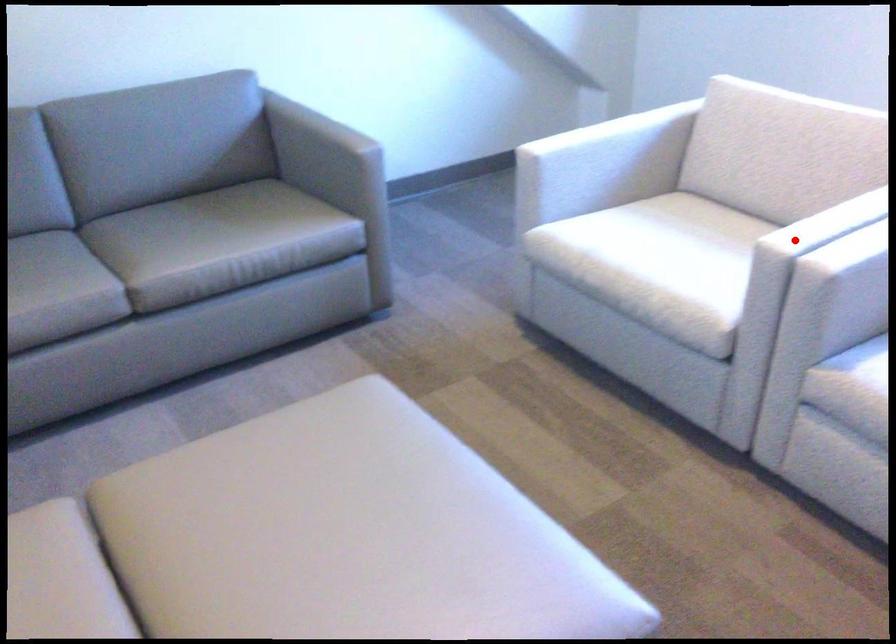
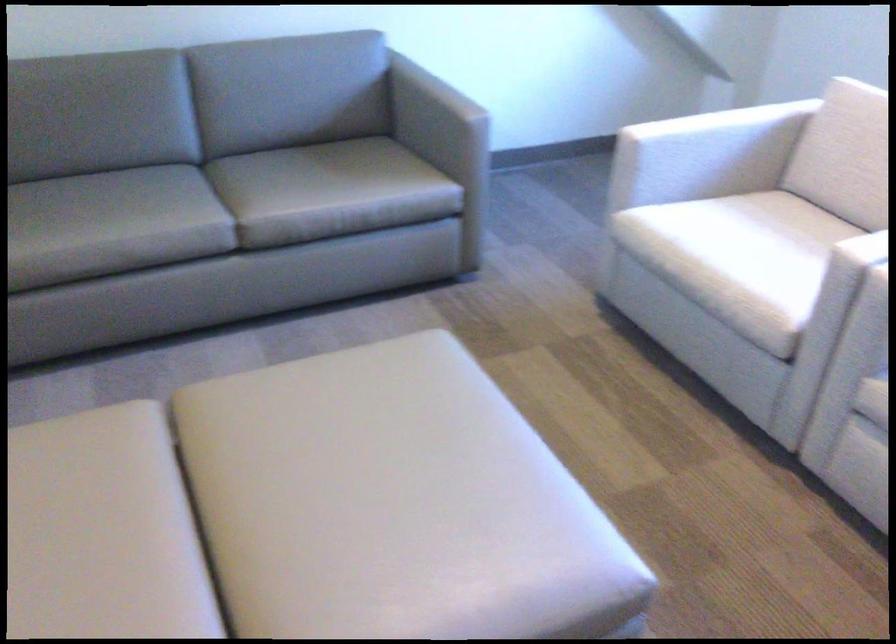
Where in the second image is the point corresponding to the highlighted location from the first image?

(872, 250)